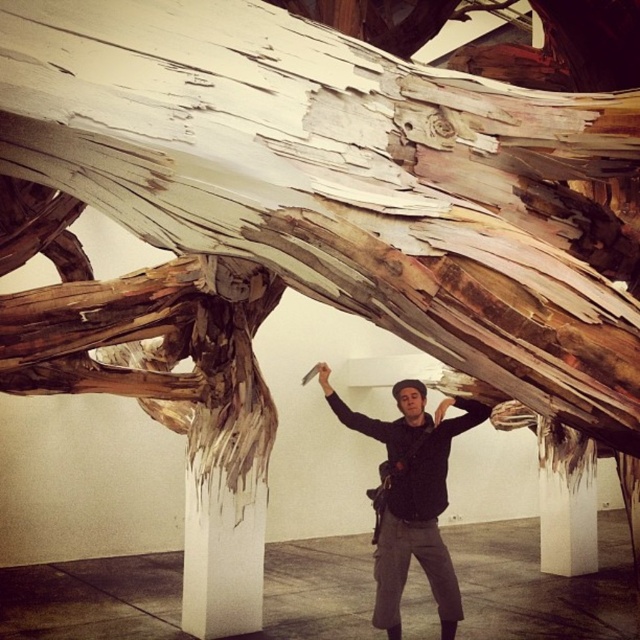
You are an art curator examining the sculpture installation. You notice the matte black jacket at center and the white smooth pillar at lower center. Which object would require more floor space if placed on the same base?

The matte black jacket at center is larger in size than the white smooth pillar at lower center, so it would require more floor space if placed on the same base.

You are an art curator planning to install a new sculpture in the gallery. You need to ensure that the matte black jacket at center and the white smooth pillar at lower center are visible to visitors. Given their height difference, which object will likely require a lower viewing angle to see its base?

The white smooth pillar at lower center is shorter than the matte black jacket at center, so visitors will need to look down slightly to see its base.

You are a photographer trying to capture the sculpture in the background. You have a camera and a matte black jacket at center. If you want to take a photo of the sculpture, which object should you pick up first and why?

You should pick up the camera first because the matte black jacket at center is 5.51 meters away from the camera, so the camera is closer to you than the jacket. To take a photo, you need the camera first before reaching for the jacket.